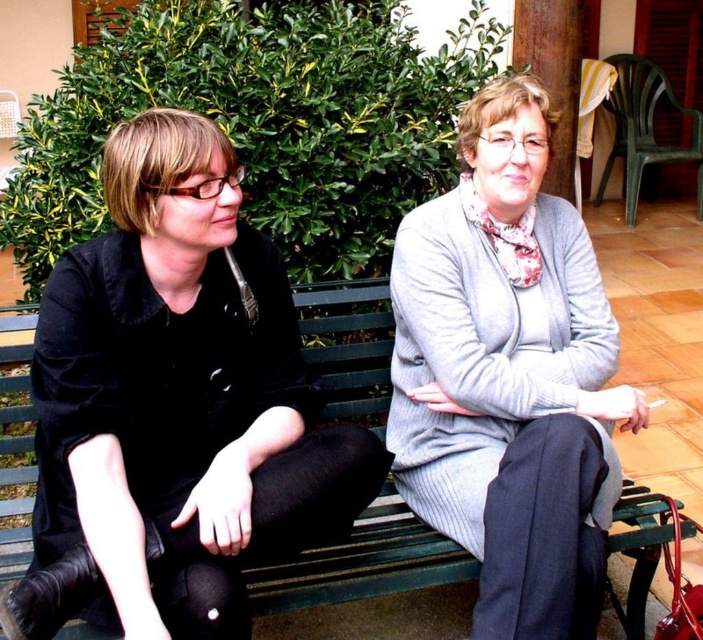
You are designing a storage system for a clothing boutique. You need to store the black velvet jacket at left and the gray woolen sweater at center. Given their sizes, which item requires more storage space?

The gray woolen sweater at center requires more storage space because it occupies more space than the black velvet jacket at left.

You are a tailor trying to determine if a new customer can wear either the black velvet jacket at left or the gray woolen sweater at center. Which garment has a greater width?

The black velvet jacket at left has a greater width than the gray woolen sweater at center.

You are an artist sketching the scene and need to place the black velvet jacket at left in your drawing. According to the coordinates provided, where should you position it on your canvas?

The black velvet jacket at left should be positioned at the 2D coordinates point (180, 394) on the canvas.